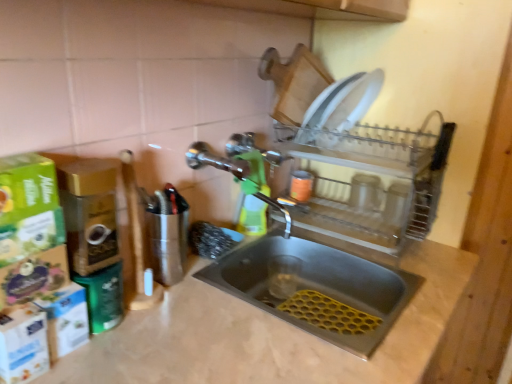
Image resolution: width=512 pixels, height=384 pixels. Identify the location of free spot in front of clear plastic dish rack at upper right. (379, 326).